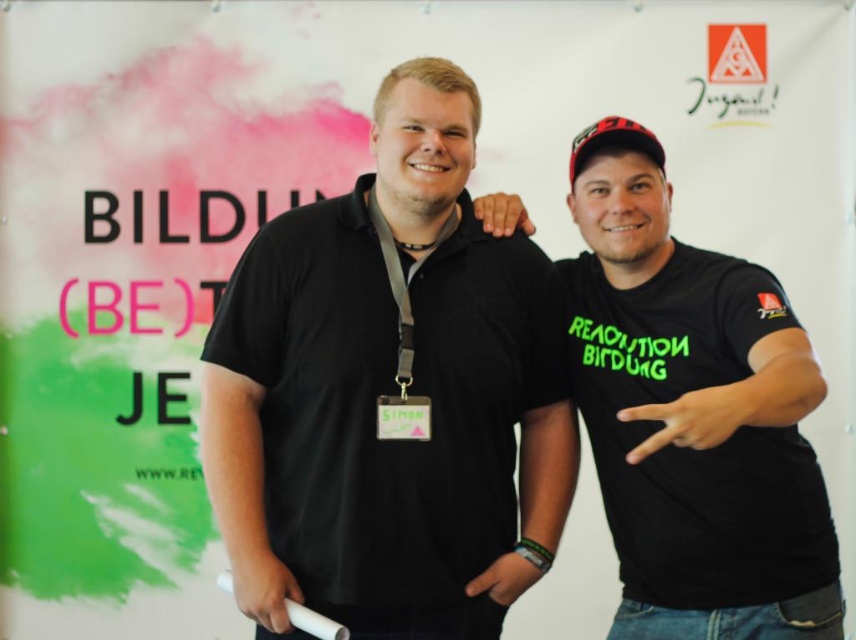
You are setting up a photo shoot and need to ensure that the black matte shirt at center and the white plastic game controller at lower center are at least 50 centimeters apart for proper lighting. Based on the image, is the current distance sufficient?

The black matte shirt at center and white plastic game controller at lower center are 41.39 centimeters apart, which is less than the required 50 centimeters. The current distance is insufficient for proper lighting.